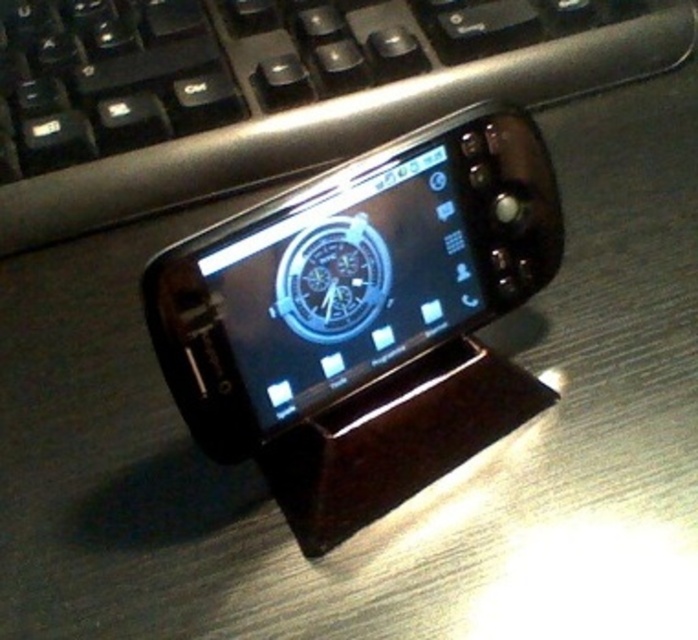
Between black plastic keyboard at upper center and satin black smartphone at center, which one has more height?

black plastic keyboard at upper center

Who is higher up, black plastic keyboard at upper center or satin black smartphone at center?

black plastic keyboard at upper center

The width and height of the screenshot is (698, 640). What do you see at coordinates (276, 92) in the screenshot?
I see `black plastic keyboard at upper center` at bounding box center [276, 92].

The height and width of the screenshot is (640, 698). Identify the location of black plastic keyboard at upper center. (276, 92).